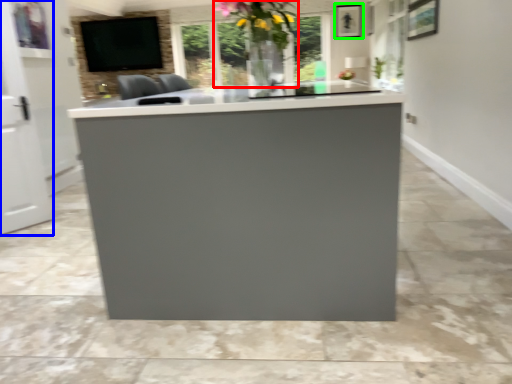
Question: Which object is the closest to the floral arrangement (highlighted by a red box)? Choose among these: glass door (highlighted by a blue box) or picture frame (highlighted by a green box).

Choices:
 (A) glass door
 (B) picture frame

Answer: (A)